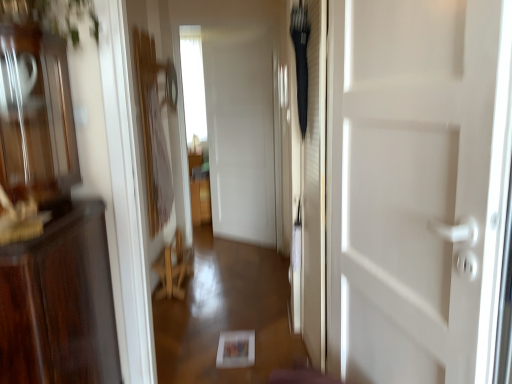
Locate an element on the screen. wooden chair at center is located at coordinates (173, 269).

Consider the image. Measure the distance between white glossy door at center and camera.

white glossy door at center and camera are 81.22 centimeters apart.

Measure the distance between transparent glass window at center and camera.

The depth of transparent glass window at center is 17.67 feet.

Locate an element on the screen. This screenshot has height=384, width=512. wooden chair at center is located at coordinates (173, 269).

Looking at this image, considering their positions, is wooden chair at center located in front of or behind white glossy door at center?

In the image, wooden chair at center appears behind white glossy door at center.

From a real-world perspective, is wooden chair at center located higher than white glossy door at center?

No, from a real-world perspective, wooden chair at center is not over white glossy door at center

Can you confirm if wooden chair at center is positioned to the right of white glossy door at center?

Incorrect, wooden chair at center is not on the right side of white glossy door at center.

Is wooden chair at center directly adjacent to white glossy door at center?

No, wooden chair at center is not with white glossy door at center.

Locate an element on the screen. This screenshot has height=384, width=512. window above the wooden chair at center (from a real-world perspective) is located at coordinates (193, 83).

Does wooden chair at center touch transparent glass window at center?

No, wooden chair at center is not next to transparent glass window at center.

Looking at their sizes, would you say wooden chair at center is wider or thinner than transparent glass window at center?

Considering their sizes, wooden chair at center looks slimmer than transparent glass window at center.

Is wooden chair at center in front of or behind transparent glass window at center in the image?

wooden chair at center is positioned closer to the viewer than transparent glass window at center.

Is transparent glass window at center surrounded by white glossy door at center?

No, white glossy door at center does not contain transparent glass window at center.

Is white glossy door at center in front of or behind transparent glass window at center in the image?

white glossy door at center is positioned closer to the viewer than transparent glass window at center.

From the image's perspective, which one is positioned higher, white glossy door at center or transparent glass window at center?

From the image's view, transparent glass window at center is above.

Is white glossy door at center thinner than wooden chair at center?

Correct, the width of white glossy door at center is less than that of wooden chair at center.

Does white glossy door at center have a lesser height compared to wooden chair at center?

In fact, white glossy door at center may be taller than wooden chair at center.

Does point (463, 22) come closer to viewer compared to point (182, 269)?

Yes.

Would you say white glossy door at center is outside wooden chair at center?

That's correct, white glossy door at center is outside of wooden chair at center.

Which of these two, transparent glass window at center or white glossy door at center, is smaller?

white glossy door at center is smaller.

Would you say white glossy door at center is part of transparent glass window at center's contents?

No, white glossy door at center is not surrounded by transparent glass window at center.

Which is more to the left, transparent glass window at center or white glossy door at center?

From the viewer's perspective, transparent glass window at center appears more on the left side.

Considering the relative sizes of transparent glass window at center and wooden chair at center in the image provided, is transparent glass window at center bigger than wooden chair at center?

Yes.

Is transparent glass window at center thinner than wooden chair at center?

No.

Which is in front, transparent glass window at center or wooden chair at center?

wooden chair at center is in front.

Identify the location of window that is behind the wooden chair at center. The width and height of the screenshot is (512, 384). (193, 83).

The width and height of the screenshot is (512, 384). In order to click on door in front of the wooden chair at center in this screenshot , I will do `click(418, 187)`.

This screenshot has width=512, height=384. What are the coordinates of `window on the left of wooden chair at center` in the screenshot? It's located at (193, 83).

Considering their positions, is white glossy door at center positioned closer to wooden chair at center than transparent glass window at center?

white glossy door at center is closer to wooden chair at center.

Estimate the real-world distances between objects in this image. Which object is closer to white glossy door at center, wooden chair at center or transparent glass window at center?

Based on the image, wooden chair at center appears to be nearer to white glossy door at center.

From the picture: When comparing their distances from transparent glass window at center, does white glossy door at center or wooden chair at center seem closer?

Based on the image, wooden chair at center appears to be nearer to transparent glass window at center.

From the image, which object appears to be nearer to wooden chair at center, transparent glass window at center or white glossy door at center?

white glossy door at center is positioned closer to the anchor wooden chair at center.

Based on their spatial positions, is wooden chair at center or white glossy door at center further from transparent glass window at center?

white glossy door at center lies further to transparent glass window at center than the other object.

Consider the image. When comparing their distances from white glossy door at center, does transparent glass window at center or wooden chair at center seem further?

transparent glass window at center is positioned further to the anchor white glossy door at center.

The height and width of the screenshot is (384, 512). I want to click on furniture between white glossy door at center and transparent glass window at center along the z-axis, so click(x=173, y=269).